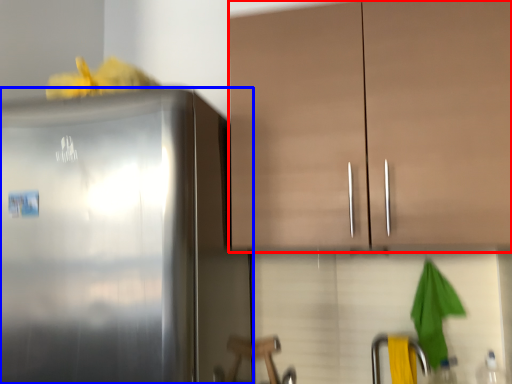
Question: Which object appears farthest to the camera in this image, cabinetry (highlighted by a red box) or refrigerator (highlighted by a blue box)?

Choices:
 (A) cabinetry
 (B) refrigerator

Answer: (A)